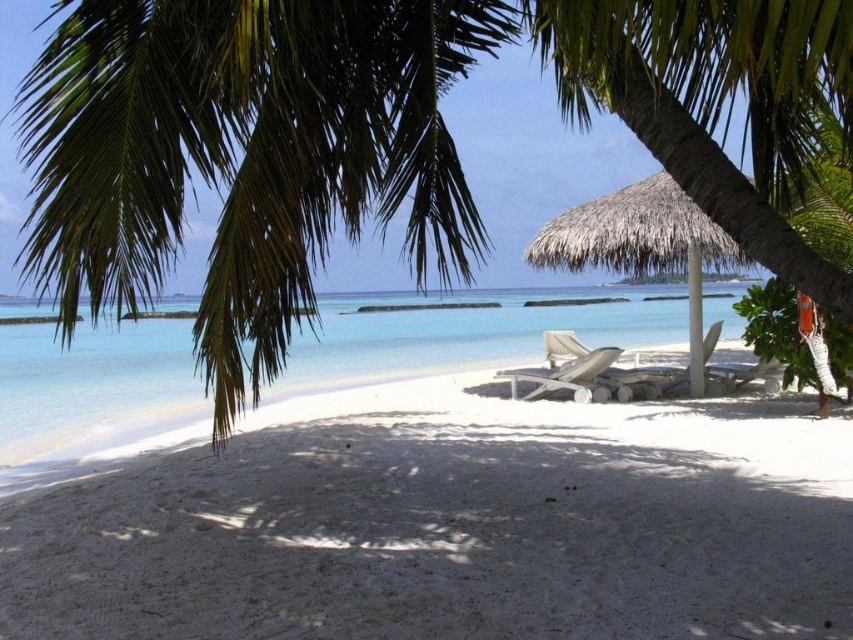
Identify the location of green leafy palm tree at center. (715, 102).

Which is more to the right, green leafy palm tree at center or clear blue water at center?

green leafy palm tree at center

Where is `green leafy palm tree at center`? Image resolution: width=853 pixels, height=640 pixels. green leafy palm tree at center is located at coordinates coord(715,102).

The height and width of the screenshot is (640, 853). Identify the location of green leafy palm tree at center. (715, 102).

Identify the location of green leafy palm tree at center. This screenshot has height=640, width=853. (715, 102).

In the scene shown: Is green leafy palm tree at center positioned in front of thatched straw umbrella at center?

Yes, it is in front of thatched straw umbrella at center.

Measure the distance between point (778,100) and camera.

Point (778,100) is 4.24 meters from camera.

You are a GUI agent. You are given a task and a screenshot of the screen. Output one action in this format:
    pyautogui.click(x=<x>, y=<y>)
    Task: Click on the green leafy palm tree at center
    
    Given the screenshot: What is the action you would take?
    pyautogui.click(x=715, y=102)

Does white sandy beach at center have a larger size compared to clear blue water at center?

Actually, white sandy beach at center might be smaller than clear blue water at center.

Can you confirm if white sandy beach at center is smaller than clear blue water at center?

Correct, white sandy beach at center occupies less space than clear blue water at center.

At what (x,y) coordinates should I click in order to perform the action: click on white sandy beach at center. Please return your answer as a coordinate pair (x, y). Image resolution: width=853 pixels, height=640 pixels. Looking at the image, I should click on (450, 525).

Identify the location of white sandy beach at center. (450, 525).